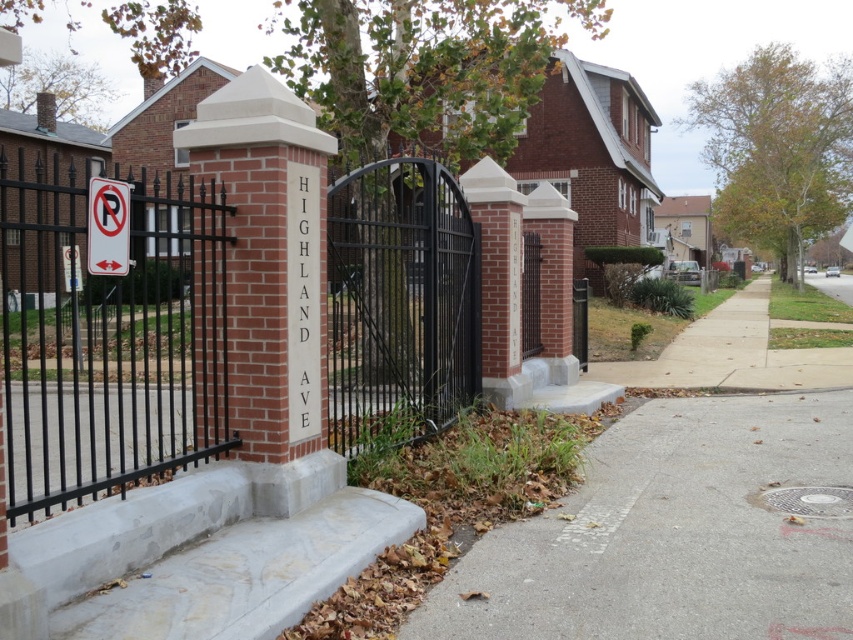
Question: Does black wrought iron gate at left have a lesser width compared to metallic gate at center?

Choices:
 (A) no
 (B) yes

Answer: (A)

Question: Does white plastic sign at upper left appear on the left side of metallic gate at center?

Choices:
 (A) yes
 (B) no

Answer: (A)

Question: Which of these objects is positioned closest to the white plastic sign at upper left?

Choices:
 (A) black wrought iron gate at left
 (B) metallic gate at center

Answer: (A)

Question: Is gray concrete sidewalk at lower right further to camera compared to metallic gate at center?

Choices:
 (A) yes
 (B) no

Answer: (B)

Question: Which point appears closest to the camera in this image?

Choices:
 (A) (132, 296)
 (B) (106, 253)
 (C) (821, 436)
 (D) (532, 308)

Answer: (B)

Question: Estimate the real-world distances between objects in this image. Which object is farther from the black wrought iron gate at left?

Choices:
 (A) gray concrete sidewalk at lower right
 (B) metallic gate at center

Answer: (A)